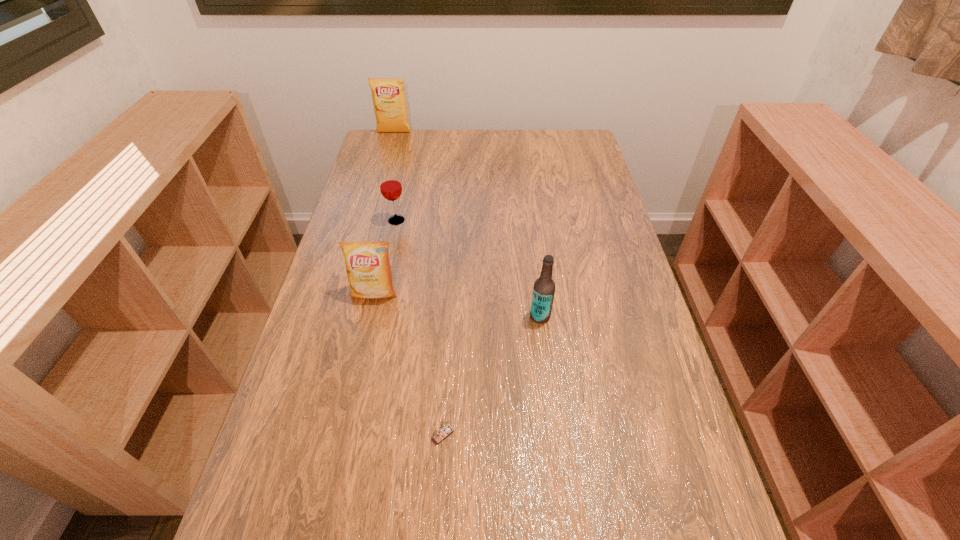
At what (x,y) coordinates should I click in order to perform the action: click on free space located on the label of the beer bottle. Please return your answer as a coordinate pair (x, y). The width and height of the screenshot is (960, 540). Looking at the image, I should click on (430, 316).

The height and width of the screenshot is (540, 960). In order to click on free space located on the label of the beer bottle in this screenshot , I will do `click(382, 316)`.

Locate an element on the screen. The height and width of the screenshot is (540, 960). vacant area situated on the label of the beer bottle is located at coordinates (498, 316).

This screenshot has width=960, height=540. Identify the location of free point located 0.350m on the front-facing side of the nearer crisp (potato chip). (343, 436).

What are the coordinates of `vacant region located on the right of the second farthest object` in the screenshot? It's located at (474, 220).

The height and width of the screenshot is (540, 960). What are the coordinates of `free point located 0.340m on the right of the shortest object` in the screenshot? It's located at (622, 435).

Locate an element on the screen. object that is positioned at the far edge is located at coordinates (388, 94).

At what (x,y) coordinates should I click in order to perform the action: click on glass present at the left edge. Please return your answer as a coordinate pair (x, y). Image resolution: width=960 pixels, height=540 pixels. Looking at the image, I should click on (390, 184).

Where is `object that is at the far left corner`? This screenshot has height=540, width=960. object that is at the far left corner is located at coordinates (388, 94).

Locate an element on the screen. Image resolution: width=960 pixels, height=540 pixels. vacant area at the far edge of the desktop is located at coordinates (511, 132).